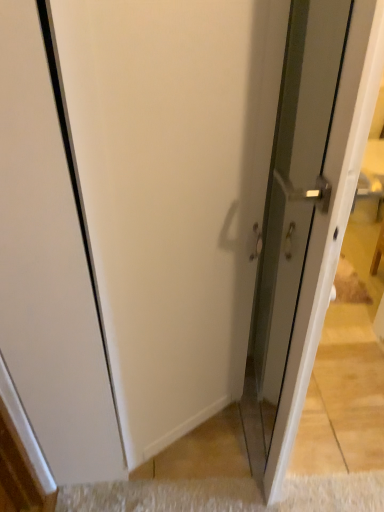
Question: In the image, is white carpet at lower center positioned in front of or behind clear glass door at right?

Choices:
 (A) behind
 (B) front

Answer: (A)

Question: From a real-world perspective, is white carpet at lower center above or below clear glass door at right?

Choices:
 (A) above
 (B) below

Answer: (B)

Question: Choose the correct answer: Is white carpet at lower center inside clear glass door at right or outside it?

Choices:
 (A) inside
 (B) outside

Answer: (B)

Question: Looking at the image, does clear glass door at right seem bigger or smaller compared to white carpet at lower center?

Choices:
 (A) small
 (B) big

Answer: (B)

Question: In terms of height, does clear glass door at right look taller or shorter compared to white carpet at lower center?

Choices:
 (A) tall
 (B) short

Answer: (A)

Question: In the image, is clear glass door at right positioned in front of or behind white carpet at lower center?

Choices:
 (A) front
 (B) behind

Answer: (A)

Question: From the image's perspective, is clear glass door at right above or below white carpet at lower center?

Choices:
 (A) above
 (B) below

Answer: (A)